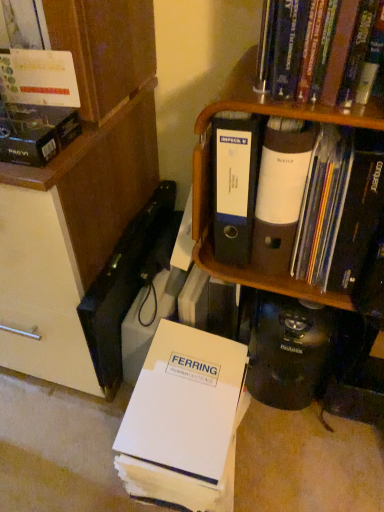
What do you see at coordinates (39, 78) in the screenshot? I see `matte cardboard box at upper left, placed as the second book when sorted from top to bottom` at bounding box center [39, 78].

You are a GUI agent. You are given a task and a screenshot of the screen. Output one action in this format:
    pyautogui.click(x=<x>, y=<y>)
    Task: Click on the hardcover book at upper right, the 4th book positioned from the bottom
    This screenshot has height=512, width=384.
    Given the screenshot: What is the action you would take?
    pos(295,46)

Where is `matte black folder at upper right, the second book positioned from the bottom`? matte black folder at upper right, the second book positioned from the bottom is located at coordinates (339, 207).

Consider the image. Which is behind, matte cardboard box at upper left, placed as the second book when sorted from top to bottom, or white paper folder at lower center, positioned as the first book in bottom-to-top order?

white paper folder at lower center, positioned as the first book in bottom-to-top order.

Considering the sizes of matte cardboard box at upper left, which is counted as the third book, starting from the bottom, and white paper folder at lower center, positioned as the first book in bottom-to-top order, in the image, is matte cardboard box at upper left, which is counted as the third book, starting from the bottom, taller or shorter than white paper folder at lower center, positioned as the first book in bottom-to-top order,?

Considering their sizes, matte cardboard box at upper left, which is counted as the third book, starting from the bottom, has less height than white paper folder at lower center, positioned as the first book in bottom-to-top order.

From the image's perspective, is matte cardboard box at upper left, which is counted as the third book, starting from the bottom, above white paper folder at lower center, positioned as the first book in bottom-to-top order?

Yes, from the image's perspective, matte cardboard box at upper left, which is counted as the third book, starting from the bottom, is above white paper folder at lower center, positioned as the first book in bottom-to-top order.

Which is more to the right, matte cardboard box at upper left, which is counted as the third book, starting from the bottom, or white paper folder at lower center, placed as the 4th book when sorted from top to bottom?

From the viewer's perspective, white paper folder at lower center, placed as the 4th book when sorted from top to bottom, appears more on the right side.

Is matte cardboard box at upper left, placed as the second book when sorted from top to bottom, not within matte black folder at upper right, the third book positioned from the top?

Yes, matte cardboard box at upper left, placed as the second book when sorted from top to bottom, is not within matte black folder at upper right, the third book positioned from the top.

From a real-world perspective, starting from the matte cardboard box at upper left, placed as the second book when sorted from top to bottom, which book is the 1st one below it? Please provide its 2D coordinates.

[(339, 207)]

Is matte cardboard box at upper left, placed as the second book when sorted from top to bottom, not close to matte black folder at upper right, the second book positioned from the bottom?

No.

Which is in front, point (318, 45) or point (67, 104)?

The point (318, 45) is in front.

From a real-world perspective, is hardcover book at upper right, the 4th book positioned from the bottom, on matte cardboard box at upper left, placed as the second book when sorted from top to bottom?

Correct, in the physical world, hardcover book at upper right, the 4th book positioned from the bottom, is higher than matte cardboard box at upper left, placed as the second book when sorted from top to bottom.

Can you confirm if hardcover book at upper right, which is counted as the 1th book, starting from the top, is smaller than matte cardboard box at upper left, which is counted as the third book, starting from the bottom?

No.

Between hardcover book at upper right, the 4th book positioned from the bottom, and matte cardboard box at upper left, which is counted as the third book, starting from the bottom, which one appears on the left side from the viewer's perspective?

matte cardboard box at upper left, which is counted as the third book, starting from the bottom, is more to the left.

Is matte cardboard box at upper left, placed as the second book when sorted from top to bottom, wider than hardcover book at upper right, the 4th book positioned from the bottom?

No.

Is matte cardboard box at upper left, which is counted as the third book, starting from the bottom, surrounding hardcover book at upper right, the 4th book positioned from the bottom?

Actually, hardcover book at upper right, the 4th book positioned from the bottom, is outside matte cardboard box at upper left, which is counted as the third book, starting from the bottom.

Does point (15, 62) lie in front of point (273, 0)?

No, (15, 62) is behind (273, 0).

Would you say matte cardboard box at upper left, which is counted as the third book, starting from the bottom, is a long distance from hardcover book at upper right, which is counted as the 1th book, starting from the top?

No.

Is white paper folder at lower center, placed as the 4th book when sorted from top to bottom, beside matte cardboard box at upper left, which is counted as the third book, starting from the bottom?

No.

Is white paper folder at lower center, placed as the 4th book when sorted from top to bottom, facing away from matte cardboard box at upper left, which is counted as the third book, starting from the bottom?

That's not correct — white paper folder at lower center, placed as the 4th book when sorted from top to bottom, is not looking away from matte cardboard box at upper left, which is counted as the third book, starting from the bottom.

From a real-world perspective, is white paper folder at lower center, placed as the 4th book when sorted from top to bottom, positioned under matte cardboard box at upper left, placed as the second book when sorted from top to bottom, based on gravity?

Yes, from a real-world perspective, white paper folder at lower center, placed as the 4th book when sorted from top to bottom, is under matte cardboard box at upper left, placed as the second book when sorted from top to bottom.

Which of these two, white paper folder at lower center, placed as the 4th book when sorted from top to bottom, or matte cardboard box at upper left, placed as the second book when sorted from top to bottom, is smaller?

Smaller between the two is matte cardboard box at upper left, placed as the second book when sorted from top to bottom.

Which point is more distant from viewer, (x=231, y=398) or (x=205, y=179)?

The point (x=231, y=398) is farther.

Is white paper folder at lower center, placed as the 4th book when sorted from top to bottom, at the right side of brown cardboard shelf at upper right?

No.

Can you confirm if white paper folder at lower center, placed as the 4th book when sorted from top to bottom, is taller than brown cardboard shelf at upper right?

No.

Is brown cardboard shelf at upper right at the right side of matte cardboard box at upper left, placed as the second book when sorted from top to bottom?

Yes.

Is brown cardboard shelf at upper right with matte cardboard box at upper left, placed as the second book when sorted from top to bottom?

No, brown cardboard shelf at upper right is not making contact with matte cardboard box at upper left, placed as the second book when sorted from top to bottom.

From the image's perspective, is brown cardboard shelf at upper right above or below matte cardboard box at upper left, placed as the second book when sorted from top to bottom?

Based on their image positions, brown cardboard shelf at upper right is located beneath matte cardboard box at upper left, placed as the second book when sorted from top to bottom.

Between point (195, 205) and point (42, 105), which one is positioned in front?

The point (42, 105) is in front.

Identify the location of book that is the 2nd object located above the white paper folder at lower center, positioned as the first book in bottom-to-top order (from the image's perspective). The width and height of the screenshot is (384, 512). (39, 78).

Starting from the matte black folder at upper right, the third book positioned from the top, which book is the 1st one in front? Please provide its 2D coordinates.

[(39, 78)]

Which object lies further to the anchor point white paper folder at lower center, placed as the 4th book when sorted from top to bottom, brown cardboard shelf at upper right or hardcover book at upper right, which is counted as the 1th book, starting from the top?

Based on the image, hardcover book at upper right, which is counted as the 1th book, starting from the top, appears to be further to white paper folder at lower center, placed as the 4th book when sorted from top to bottom.

Considering their positions, is brown cardboard shelf at upper right positioned closer to white paper folder at lower center, placed as the 4th book when sorted from top to bottom, than matte cardboard box at upper left, which is counted as the third book, starting from the bottom?

brown cardboard shelf at upper right lies closer to white paper folder at lower center, placed as the 4th book when sorted from top to bottom, than the other object.

Based on their spatial positions, is hardcover book at upper right, the 4th book positioned from the bottom, or brown cardboard shelf at upper right further from matte black folder at upper right, the third book positioned from the top?

Among the two, hardcover book at upper right, the 4th book positioned from the bottom, is located further to matte black folder at upper right, the third book positioned from the top.

From the image, which object appears to be farther from white paper folder at lower center, positioned as the first book in bottom-to-top order, hardcover book at upper right, which is counted as the 1th book, starting from the top, or brown cardboard shelf at upper right?

Among the two, hardcover book at upper right, which is counted as the 1th book, starting from the top, is located further to white paper folder at lower center, positioned as the first book in bottom-to-top order.

Based on their spatial positions, is white paper folder at lower center, positioned as the first book in bottom-to-top order, or matte cardboard box at upper left, placed as the second book when sorted from top to bottom, closer to brown cardboard shelf at upper right?

Based on the image, white paper folder at lower center, positioned as the first book in bottom-to-top order, appears to be nearer to brown cardboard shelf at upper right.

From the picture: Based on their spatial positions, is matte cardboard box at upper left, placed as the second book when sorted from top to bottom, or white paper folder at lower center, placed as the 4th book when sorted from top to bottom, closer to matte black folder at upper right, the third book positioned from the top?

The object closer to matte black folder at upper right, the third book positioned from the top, is white paper folder at lower center, placed as the 4th book when sorted from top to bottom.

Looking at the image, which one is located further to matte black folder at upper right, the third book positioned from the top, brown cardboard shelf at upper right or white paper folder at lower center, positioned as the first book in bottom-to-top order?

white paper folder at lower center, positioned as the first book in bottom-to-top order, lies further to matte black folder at upper right, the third book positioned from the top, than the other object.

When comparing their distances from matte cardboard box at upper left, which is counted as the third book, starting from the bottom, does white paper folder at lower center, positioned as the first book in bottom-to-top order, or hardcover book at upper right, which is counted as the 1th book, starting from the top, seem closer?

hardcover book at upper right, which is counted as the 1th book, starting from the top.

I want to click on book that lies between matte cardboard box at upper left, which is counted as the third book, starting from the bottom, and white paper folder at lower center, placed as the 4th book when sorted from top to bottom, from top to bottom, so click(x=339, y=207).

Where is `shelf between hardcover book at upper right, which is counted as the 1th book, starting from the top, and white paper folder at lower center, placed as the 4th book when sorted from top to bottom, vertically`? The image size is (384, 512). shelf between hardcover book at upper right, which is counted as the 1th book, starting from the top, and white paper folder at lower center, placed as the 4th book when sorted from top to bottom, vertically is located at coordinates (208, 173).

Find the location of a particular element. The image size is (384, 512). shelf that lies between matte cardboard box at upper left, which is counted as the third book, starting from the bottom, and white paper folder at lower center, placed as the 4th book when sorted from top to bottom, from top to bottom is located at coordinates (208, 173).

Find the location of a particular element. This screenshot has width=384, height=512. shelf between matte black folder at upper right, the third book positioned from the top, and white paper folder at lower center, positioned as the first book in bottom-to-top order, from top to bottom is located at coordinates (208, 173).